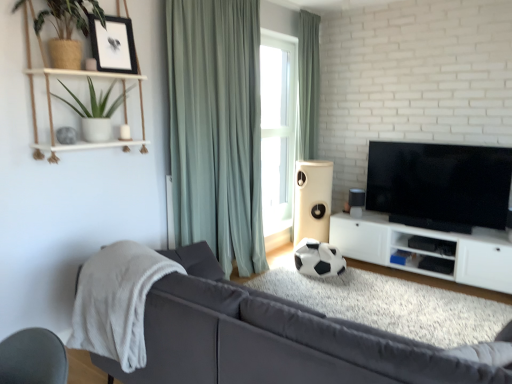
This screenshot has height=384, width=512. What are the coordinates of `vacant space in front of satin black speaker at lower right, which is the 1th speaker from right to left` in the screenshot? It's located at (361, 219).